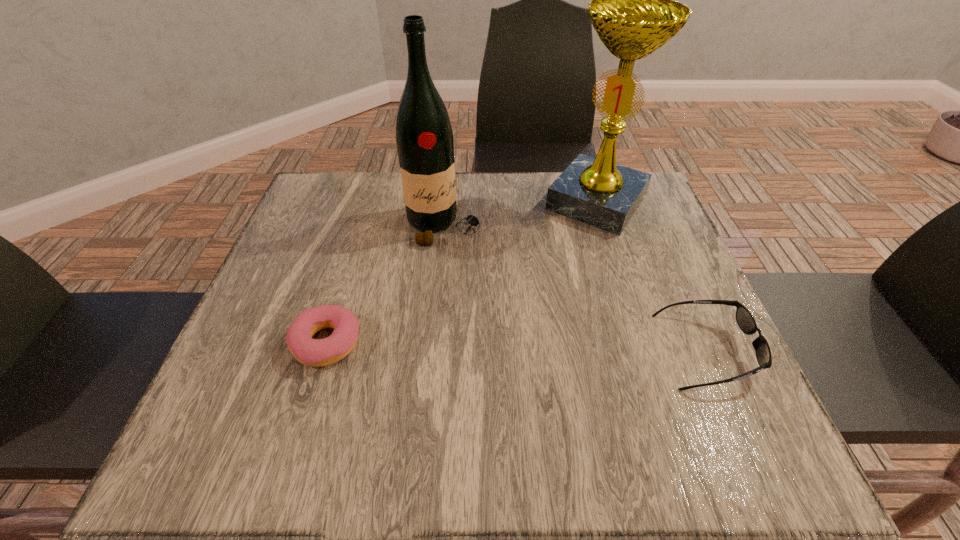
Identify the location of the shortest object. This screenshot has height=540, width=960. (321, 352).

Identify the location of doughnut. (321, 352).

Locate an element on the screen. sunglasses is located at coordinates (746, 322).

Locate an element on the screen. This screenshot has width=960, height=540. award is located at coordinates (634, 11).

Locate an element on the screen. wine bottle is located at coordinates (424, 137).

I want to click on vacant space located 0.150m on the back of the shortest object, so click(350, 264).

This screenshot has height=540, width=960. Identify the location of free point located 0.250m on the front-facing side of the award. (525, 295).

Where is `vacant region located 0.250m on the front-facing side of the award`? vacant region located 0.250m on the front-facing side of the award is located at coordinates (525, 295).

At what (x,y) coordinates should I click in order to perform the action: click on vacant position located 0.210m on the front-facing side of the award. Please return your answer as a coordinate pair (x, y). The width and height of the screenshot is (960, 540). Looking at the image, I should click on click(x=535, y=284).

At what (x,y) coordinates should I click in order to perform the action: click on vacant point located on the surface of the third object from right to left. Please return your answer as a coordinate pair (x, y). This screenshot has height=540, width=960. Looking at the image, I should click on (471, 262).